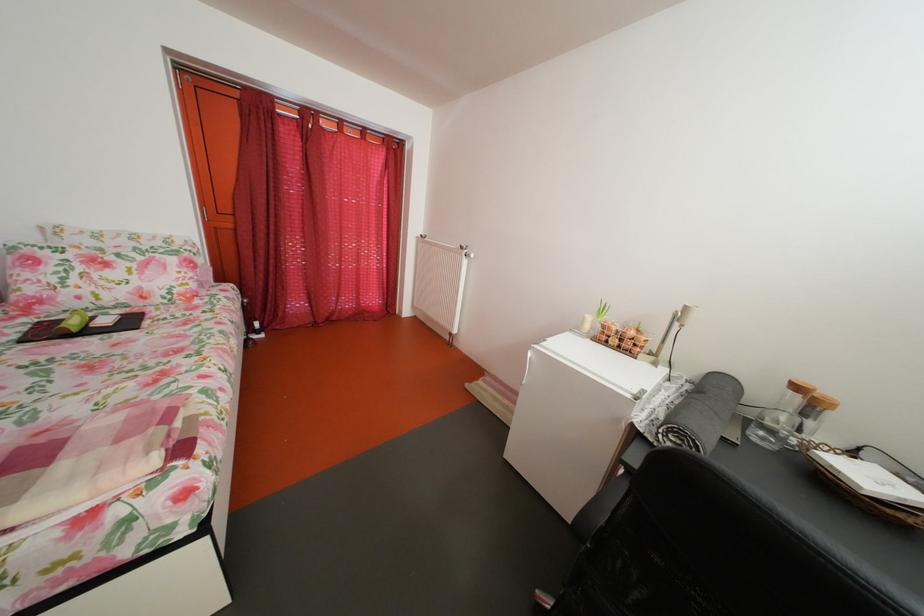
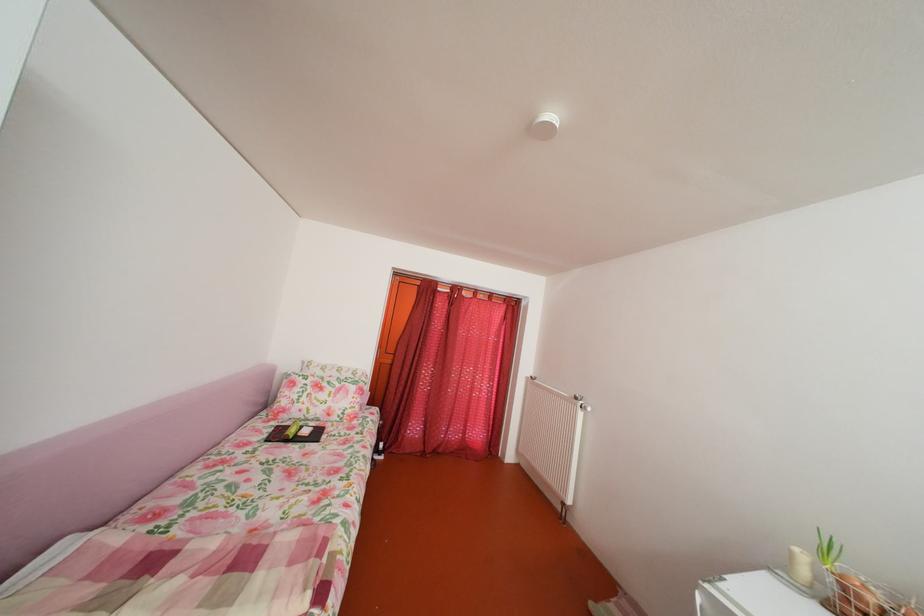
Where in the second image is the point corresponding to (x=621, y=334) from the first image?

(871, 605)